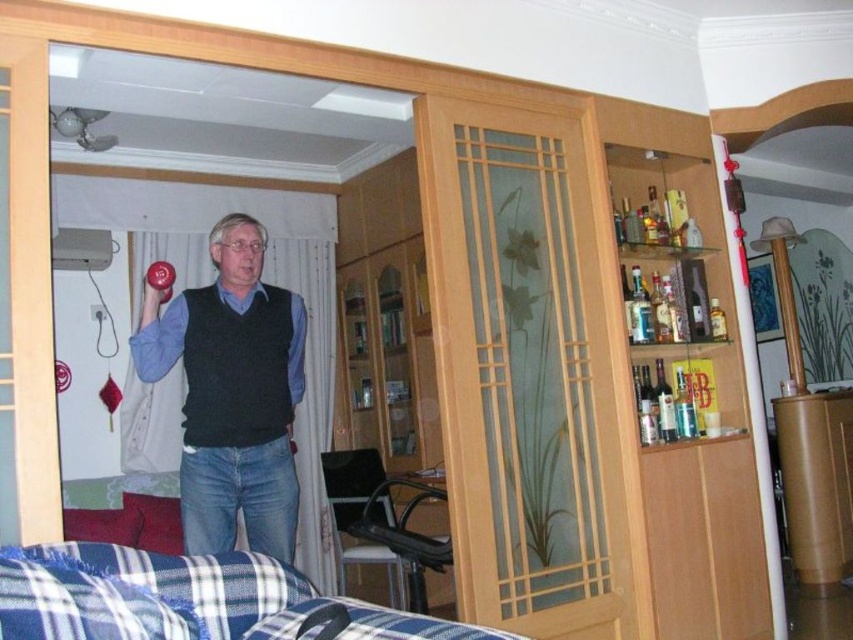
You are a delivery person standing at the entrance of the living room. You need to deliver a package to the recipient who is standing behind the transparent glass door at center. The package is 1.8 meters long. Can you carry the package through the entrance without tilting it sideways?

The transparent glass door at center is 2.41 meters away from the viewer. Since the package is 1.8 meters long, which is shorter than the distance to the door, you can carry the package through the entrance without tilting it sideways.

You are a tailor measuring fabric for a client. You have a piece of blue plaid fabric at lower left and a matte black vest at center. Which fabric piece is wider?

The blue plaid fabric at lower left is wider than the matte black vest at center.